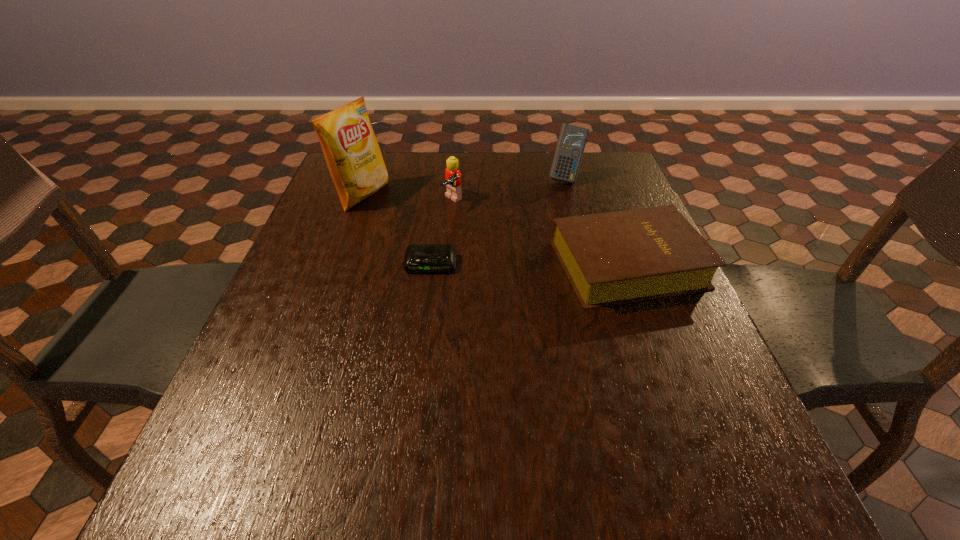
Where is `object positioned at the left edge`? This screenshot has width=960, height=540. object positioned at the left edge is located at coordinates (353, 156).

Where is `Bible that is positioned at the right edge`? The width and height of the screenshot is (960, 540). Bible that is positioned at the right edge is located at coordinates (611, 258).

This screenshot has height=540, width=960. I want to click on calculator at the right edge, so click(x=572, y=139).

Where is `object that is at the far left corner`? The image size is (960, 540). object that is at the far left corner is located at coordinates (353, 156).

Where is `object positioned at the far right corner`? The image size is (960, 540). object positioned at the far right corner is located at coordinates (572, 139).

Where is `free point at the far edge`? The height and width of the screenshot is (540, 960). free point at the far edge is located at coordinates (476, 165).

At what (x,y) coordinates should I click in order to perform the action: click on free point at the near edge. Please return your answer as a coordinate pair (x, y). The height and width of the screenshot is (540, 960). Looking at the image, I should click on (423, 423).

This screenshot has height=540, width=960. In order to click on vacant space at the left edge in this screenshot , I will do `click(273, 333)`.

Where is `free space at the right edge`? free space at the right edge is located at coordinates (605, 204).

The height and width of the screenshot is (540, 960). In the image, there is a desktop. In order to click on vacant space at the near left corner in this screenshot , I will do `click(281, 408)`.